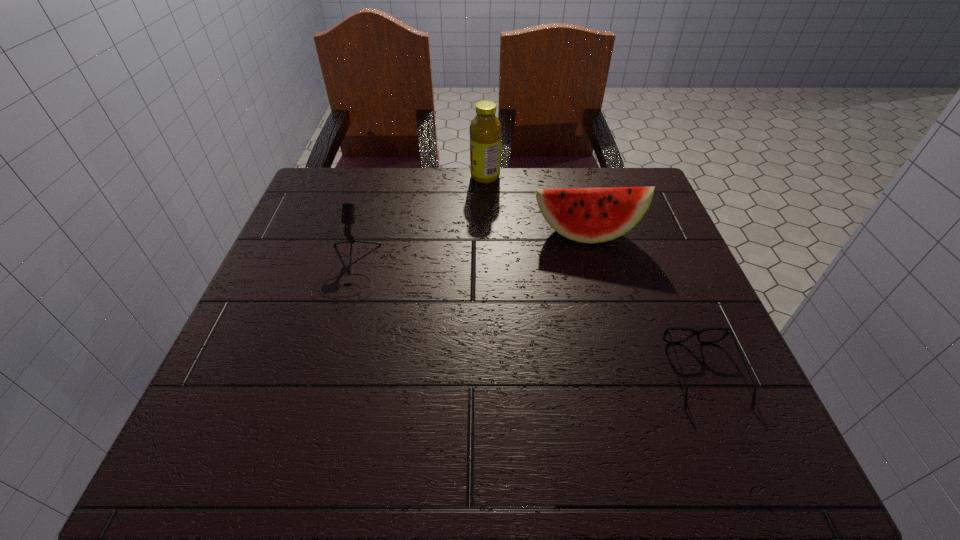
At what (x,y) coordinates should I click in order to perform the action: click on empty space that is in between the spectacles and the microphone. Please return your answer as a coordinate pair (x, y). The image size is (960, 540). Looking at the image, I should click on pyautogui.click(x=526, y=322).

Locate an element on the screen. This screenshot has height=540, width=960. free space between the third tallest object and the third shortest object is located at coordinates (467, 252).

Where is `vacant area that lies between the nearest object and the third shortest object`? vacant area that lies between the nearest object and the third shortest object is located at coordinates coord(644,304).

This screenshot has width=960, height=540. Identify the location of vacant area between the third tallest object and the watermelon. (467, 252).

You are a GUI agent. You are given a task and a screenshot of the screen. Output one action in this format:
    pyautogui.click(x=<x>, y=<y>)
    Task: Click on the third closest object to the tallest object
    This screenshot has height=540, width=960.
    Given the screenshot: What is the action you would take?
    coord(728,330)

Identify which object is located as the nearest to the second object from left to right. Please provide its 2D coordinates. Your answer should be formatted as a tuple, i.e. [(x, y)], where the tuple contains the x and y coordinates of a point satisfying the conditions above.

[(588, 215)]

Locate an element on the screen. vacant space that satisfies the following two spatial constraints: 1. on the front label of the farthest object; 2. on the stand of the microphone is located at coordinates (487, 270).

Where is `free space that satisfies the following two spatial constraints: 1. on the front label of the fruit juice; 2. on the stand of the microphone`? free space that satisfies the following two spatial constraints: 1. on the front label of the fruit juice; 2. on the stand of the microphone is located at coordinates (487, 270).